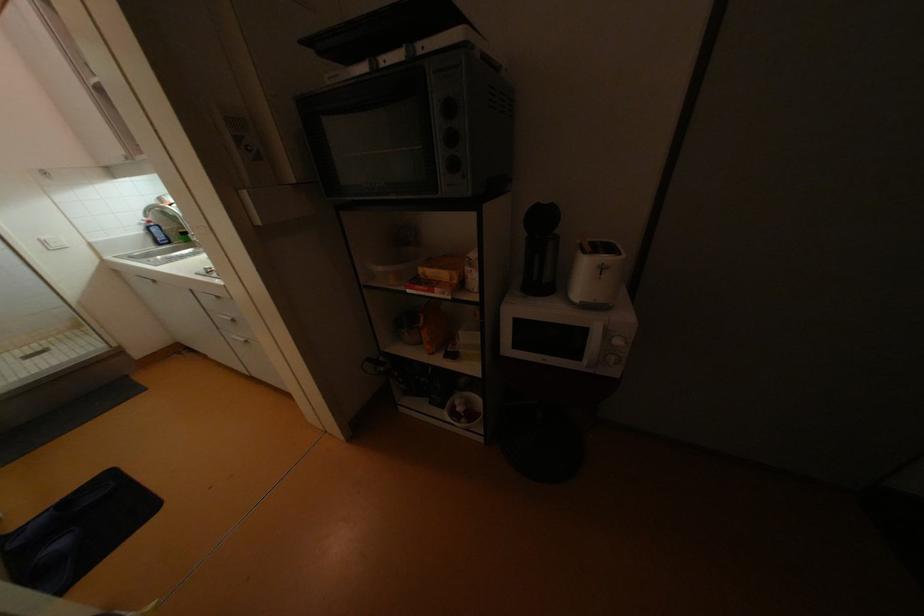
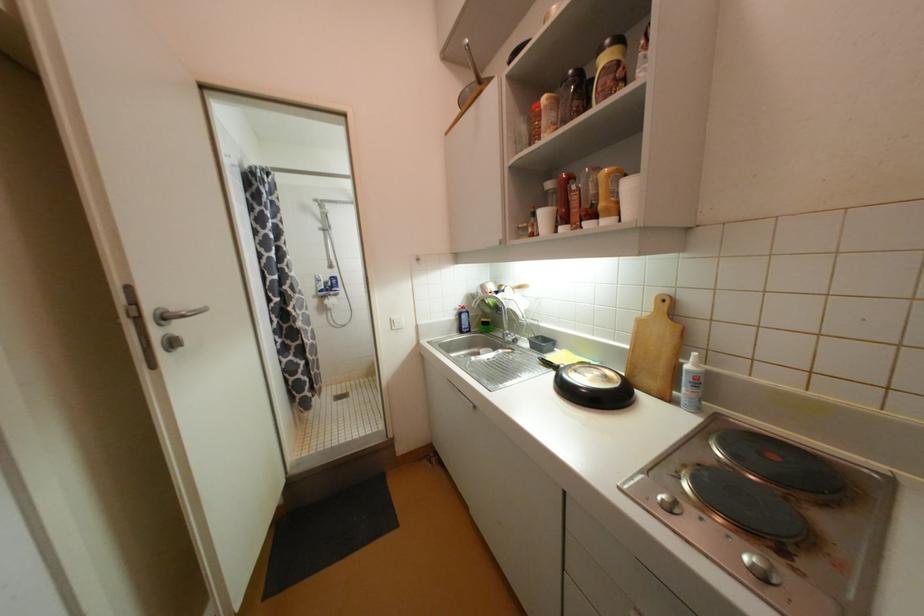
Where in the second image is the point corresponding to pixel 49 243 from the first image?

(396, 323)